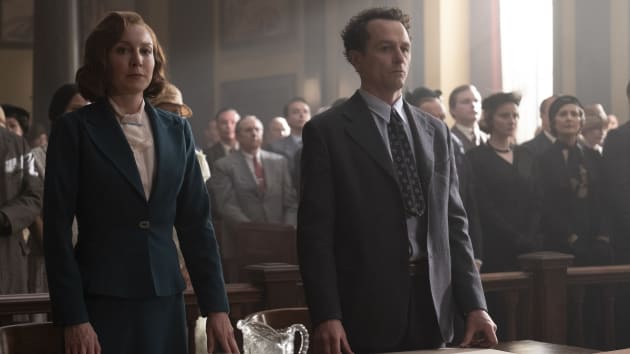
Where is `glass pitcher`? This screenshot has width=630, height=354. glass pitcher is located at coordinates (265, 338).